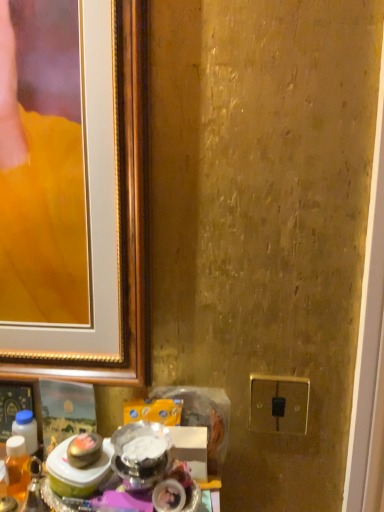
Question: Is gold metallic switch at lower right situated inside translucent amber liquid at lower left or outside?

Choices:
 (A) inside
 (B) outside

Answer: (B)

Question: Based on their positions, is gold metallic switch at lower right located to the left or right of translucent amber liquid at lower left?

Choices:
 (A) right
 (B) left

Answer: (A)

Question: Considering the positions of gold metallic switch at lower right and translucent amber liquid at lower left in the image, is gold metallic switch at lower right wider or thinner than translucent amber liquid at lower left?

Choices:
 (A) thin
 (B) wide

Answer: (A)

Question: Based on their sizes in the image, would you say translucent amber liquid at lower left is bigger or smaller than gold metallic switch at lower right?

Choices:
 (A) small
 (B) big

Answer: (B)

Question: Considering the relative positions of translucent amber liquid at lower left and gold metallic switch at lower right in the image provided, is translucent amber liquid at lower left to the left or to the right of gold metallic switch at lower right?

Choices:
 (A) left
 (B) right

Answer: (A)

Question: Is point (23, 450) closer or farther from the camera than point (279, 394)?

Choices:
 (A) closer
 (B) farther

Answer: (A)

Question: From the image's perspective, relative to gold metallic switch at lower right, is translucent amber liquid at lower left above or below?

Choices:
 (A) above
 (B) below

Answer: (B)